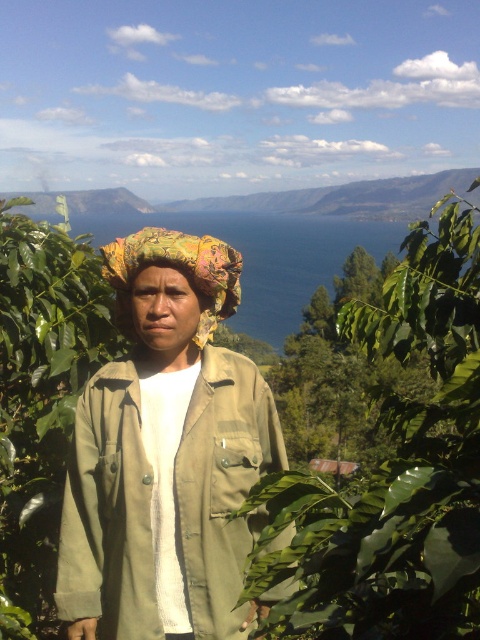
Is point (406, 260) positioned before point (106, 588)?

No, (406, 260) is further to viewer.

Which is behind, point (457, 257) or point (249, 440)?

The point (457, 257) is more distant.

You are a GUI agent. You are given a task and a screenshot of the screen. Output one action in this format:
    pyautogui.click(x=<x>, y=<y>)
    Task: Click on the green leafy plant at center
    The height and width of the screenshot is (640, 480).
    Given the screenshot: What is the action you would take?
    pyautogui.click(x=396, y=467)

Is point (261, 518) positioned before point (127, 307)?

Yes.

Can you confirm if olive green fabric trench coat at center is smaller than printed fabric headscarf at center?

Yes, olive green fabric trench coat at center is smaller than printed fabric headscarf at center.

I want to click on olive green fabric trench coat at center, so click(165, 499).

Does green leafy plant at center have a smaller size compared to printed fabric headscarf at center?

No, green leafy plant at center is not smaller than printed fabric headscarf at center.

Does point (456, 513) lie in front of point (204, 340)?

Yes, it is.

Which is behind, point (452, 285) or point (194, 288)?

Positioned behind is point (452, 285).

The height and width of the screenshot is (640, 480). I want to click on green leafy plant at center, so click(x=396, y=467).